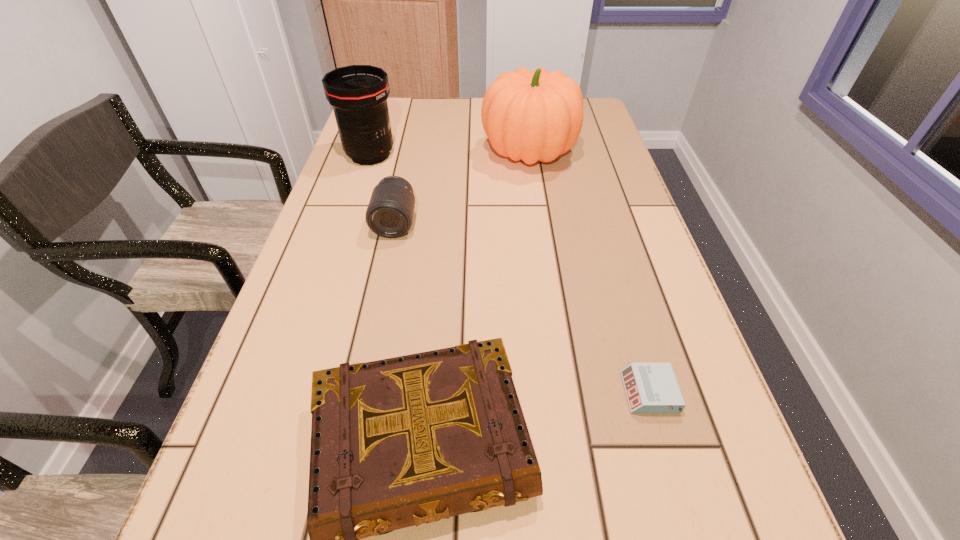
Identify the location of pumpkin at the right edge. This screenshot has height=540, width=960. (535, 116).

Where is `alarm clock situated at the right edge`? The image size is (960, 540). alarm clock situated at the right edge is located at coordinates (651, 388).

Find the location of a particular element. The height and width of the screenshot is (540, 960). object that is positioned at the far right corner is located at coordinates (535, 116).

Where is `free space at the far edge`? The width and height of the screenshot is (960, 540). free space at the far edge is located at coordinates [452, 119].

Image resolution: width=960 pixels, height=540 pixels. In the image, there is a desktop. Find the location of `vacant space at the left edge`. vacant space at the left edge is located at coordinates (348, 259).

In the image, there is a desktop. Where is `free region at the right edge`? This screenshot has height=540, width=960. free region at the right edge is located at coordinates (657, 279).

In the image, there is a desktop. Identify the location of vacant area at the far right corner. [x=588, y=114].

Locate an element on the screen. The height and width of the screenshot is (540, 960). vacant area between the shortest object and the pumpkin is located at coordinates (589, 273).

At what (x,y) coordinates should I click in order to perform the action: click on vacant point located between the shortest object and the third nearest object. Please return your answer as a coordinate pair (x, y). This screenshot has width=960, height=540. Looking at the image, I should click on (522, 307).

Identify the location of free space that is in between the farther telephoto lens and the alarm clock. (510, 274).